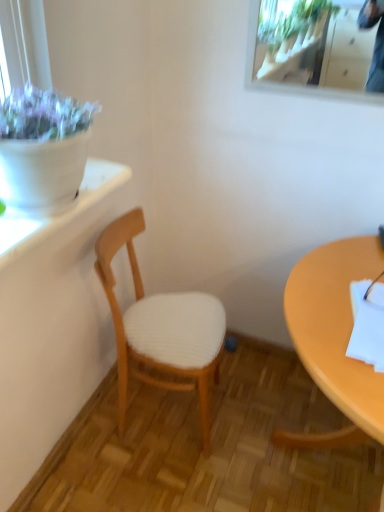
Question: Is matte yellow desk at right closer to the viewer compared to wooden chair at center?

Choices:
 (A) no
 (B) yes

Answer: (B)

Question: Does matte yellow desk at right touch wooden chair at center?

Choices:
 (A) no
 (B) yes

Answer: (A)

Question: From a real-world perspective, is matte yellow desk at right below wooden chair at center?

Choices:
 (A) yes
 (B) no

Answer: (A)

Question: Are matte yellow desk at right and wooden chair at center located far from each other?

Choices:
 (A) yes
 (B) no

Answer: (B)

Question: From a real-world perspective, is matte yellow desk at right physically above wooden chair at center?

Choices:
 (A) no
 (B) yes

Answer: (A)

Question: Is clear glass mirror at upper right taller or shorter than wooden chair at center?

Choices:
 (A) tall
 (B) short

Answer: (B)

Question: From the image's perspective, relative to wooden chair at center, is clear glass mirror at upper right above or below?

Choices:
 (A) below
 (B) above

Answer: (B)

Question: Looking at their shapes, would you say clear glass mirror at upper right is wider or thinner than wooden chair at center?

Choices:
 (A) thin
 (B) wide

Answer: (A)

Question: Looking at the image, does clear glass mirror at upper right seem bigger or smaller compared to wooden chair at center?

Choices:
 (A) big
 (B) small

Answer: (B)

Question: Is matte yellow desk at right bigger or smaller than wooden chair at center?

Choices:
 (A) big
 (B) small

Answer: (A)

Question: In the image, is matte yellow desk at right positioned in front of or behind wooden chair at center?

Choices:
 (A) behind
 (B) front

Answer: (B)

Question: In terms of height, does matte yellow desk at right look taller or shorter compared to wooden chair at center?

Choices:
 (A) tall
 (B) short

Answer: (B)

Question: From a real-world perspective, is matte yellow desk at right physically located above or below wooden chair at center?

Choices:
 (A) below
 (B) above

Answer: (A)

Question: Considering the positions of clear glass mirror at upper right and matte yellow desk at right in the image, is clear glass mirror at upper right wider or thinner than matte yellow desk at right?

Choices:
 (A) thin
 (B) wide

Answer: (A)

Question: Considering the positions of clear glass mirror at upper right and matte yellow desk at right in the image, is clear glass mirror at upper right bigger or smaller than matte yellow desk at right?

Choices:
 (A) big
 (B) small

Answer: (B)